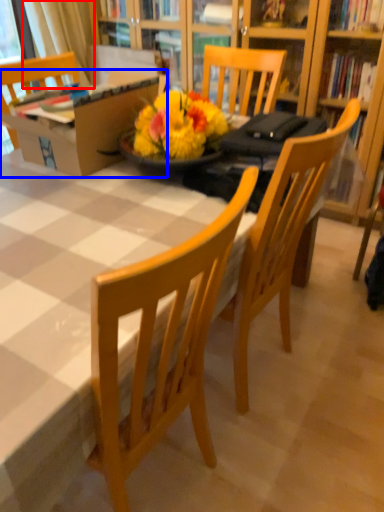
Question: Which object is further to the camera taking this photo, curtain (highlighted by a red box) or box (highlighted by a blue box)?

Choices:
 (A) curtain
 (B) box

Answer: (A)